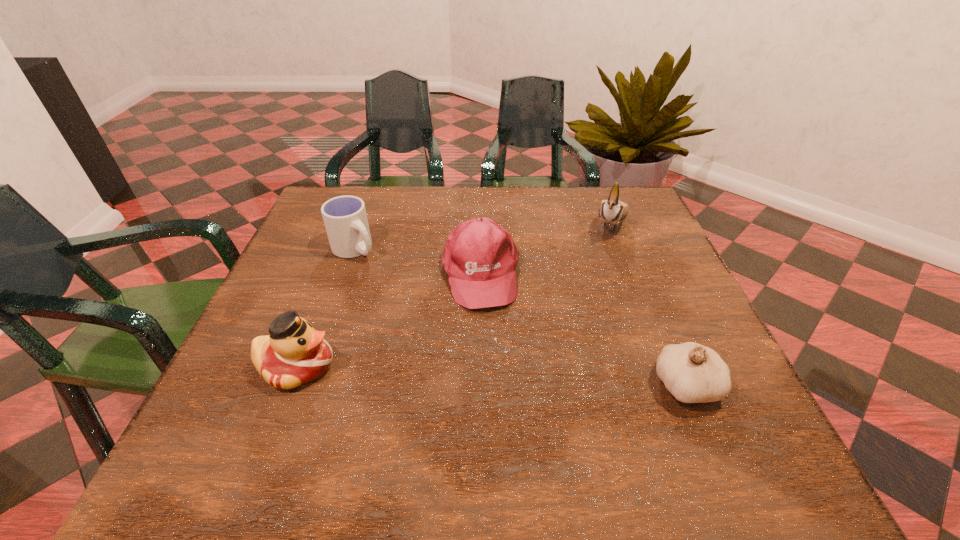
Where is `cup at the left edge`? cup at the left edge is located at coordinates click(x=345, y=218).

You are a GUI agent. You are given a task and a screenshot of the screen. Output one action in this format:
    pyautogui.click(x=<x>, y=<y>)
    Task: Click on the garlic situated at the right edge
    
    Given the screenshot: What is the action you would take?
    pyautogui.click(x=693, y=373)

Find the location of `bird that is at the right edge`. bird that is at the right edge is located at coordinates (613, 210).

This screenshot has height=540, width=960. What are the coordinates of `object at the near left corner` in the screenshot? It's located at (294, 353).

Image resolution: width=960 pixels, height=540 pixels. What are the coordinates of `object located in the far right corner section of the desktop` in the screenshot? It's located at (613, 210).

At what (x,y) coordinates should I click in order to perform the action: click on object located in the near right corner section of the desktop. Please return your answer as a coordinate pair (x, y). The height and width of the screenshot is (540, 960). Looking at the image, I should click on (693, 373).

Find the location of a particular element. free spot at the far edge of the desktop is located at coordinates (513, 208).

Image resolution: width=960 pixels, height=540 pixels. Identify the location of vacant position at the near edge of the desktop. (418, 401).

At what (x,y) coordinates should I click in order to perform the action: click on vacant space at the right edge of the desktop. Please return your answer as a coordinate pair (x, y). Looking at the image, I should click on (624, 239).

Where is `vacant space at the far right corner of the desktop`? The image size is (960, 540). vacant space at the far right corner of the desktop is located at coordinates (619, 232).